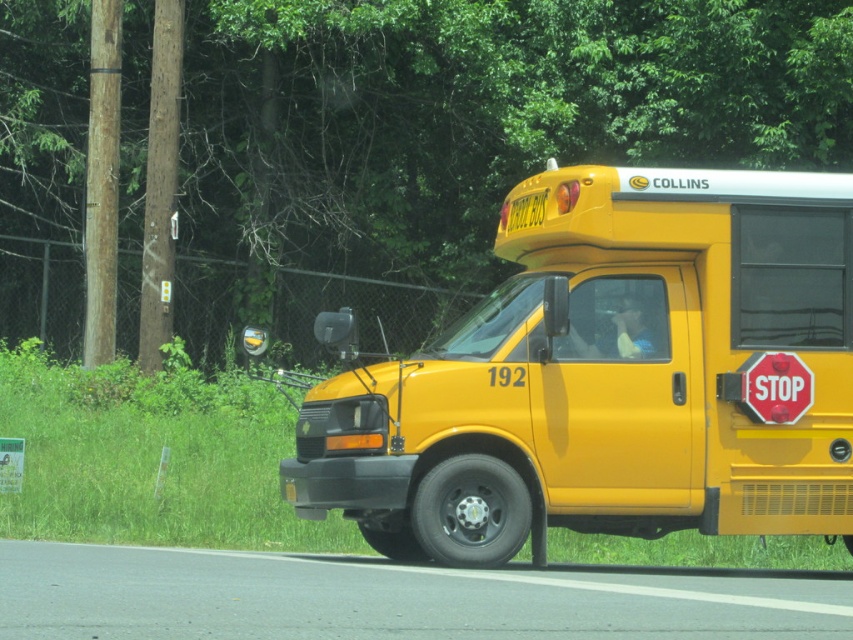
Question: Which is nearer to the matte yellow school bus at center?

Choices:
 (A) red matte stop sign at center
 (B) green leafy tree at upper center

Answer: (A)

Question: Which point appears closest to the camera in this image?

Choices:
 (A) (770, 406)
 (B) (554, 52)
 (C) (534, 332)

Answer: (C)

Question: Does matte yellow school bus at center appear on the left side of red matte stop sign at center?

Choices:
 (A) no
 (B) yes

Answer: (B)

Question: Can you confirm if green leafy tree at upper center is wider than matte yellow school bus at center?

Choices:
 (A) no
 (B) yes

Answer: (B)

Question: Which of the following is the farthest from the observer?

Choices:
 (A) red matte stop sign at center
 (B) matte yellow school bus at center

Answer: (A)

Question: Does green leafy tree at upper center appear on the left side of matte yellow school bus at center?

Choices:
 (A) yes
 (B) no

Answer: (A)